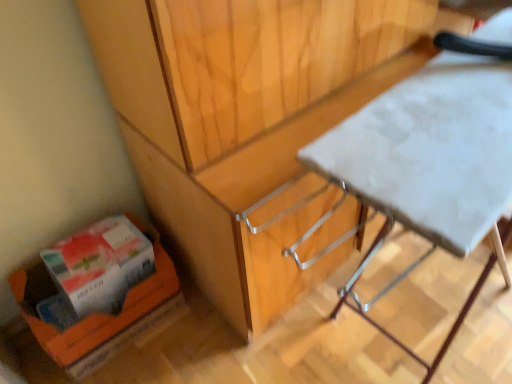
The height and width of the screenshot is (384, 512). I want to click on vacant space to the right of orange cardboard box at lower left, so click(192, 331).